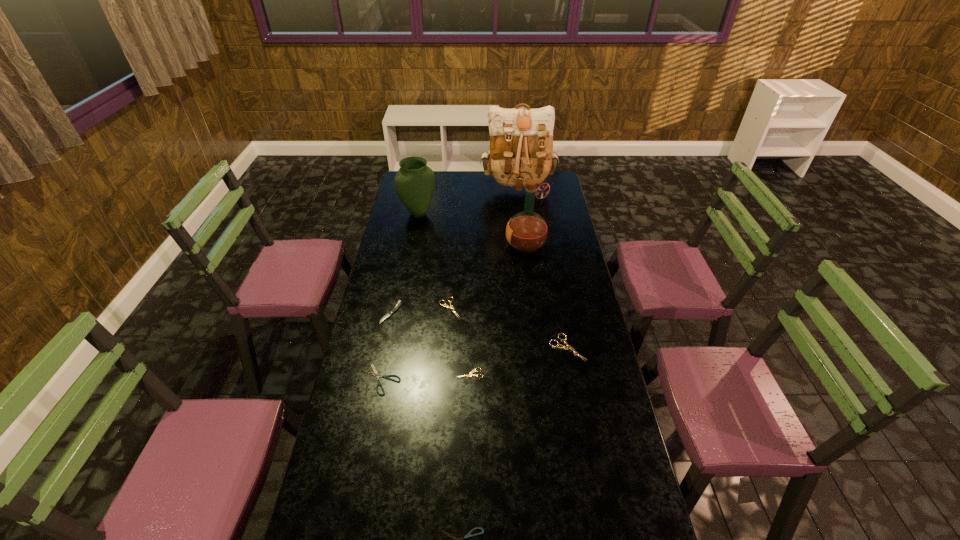
Locate an element on the screen. Image resolution: width=960 pixels, height=540 pixels. shears present at the right edge is located at coordinates (563, 347).

Where is `object positioned at the far right corner`? This screenshot has width=960, height=540. object positioned at the far right corner is located at coordinates (521, 139).

Find the location of a particular element. The image size is (960, 540). free space at the far edge of the desktop is located at coordinates (481, 178).

The width and height of the screenshot is (960, 540). In order to click on free space at the left edge of the desktop in this screenshot , I will do `click(350, 373)`.

At what (x,y) coordinates should I click in order to perform the action: click on vacant space at the right edge. Please return your answer as a coordinate pair (x, y). This screenshot has width=960, height=540. Looking at the image, I should click on 578,373.

In the image, there is a desktop. In order to click on free space at the far right corner in this screenshot , I will do 552,177.

This screenshot has height=540, width=960. What are the coordinates of `vacant area between the backpack and the rightmost shears` in the screenshot? It's located at (542, 268).

I want to click on unoccupied position between the bigger black shears and the tallest object, so click(449, 284).

Find the location of a particular element. free space between the second smallest beige shears and the second nearest beige shears is located at coordinates (508, 327).

Identify the location of vacant region between the seventh shortest object and the seventh nearest object. (472, 230).